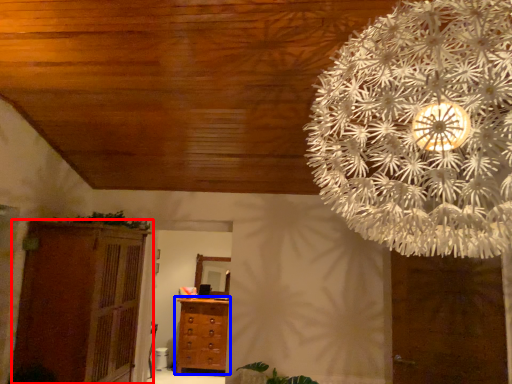
Question: Which object appears closest to the camera in this image, cupboard (highlighted by a red box) or chest of drawers (highlighted by a blue box)?

Choices:
 (A) cupboard
 (B) chest of drawers

Answer: (A)